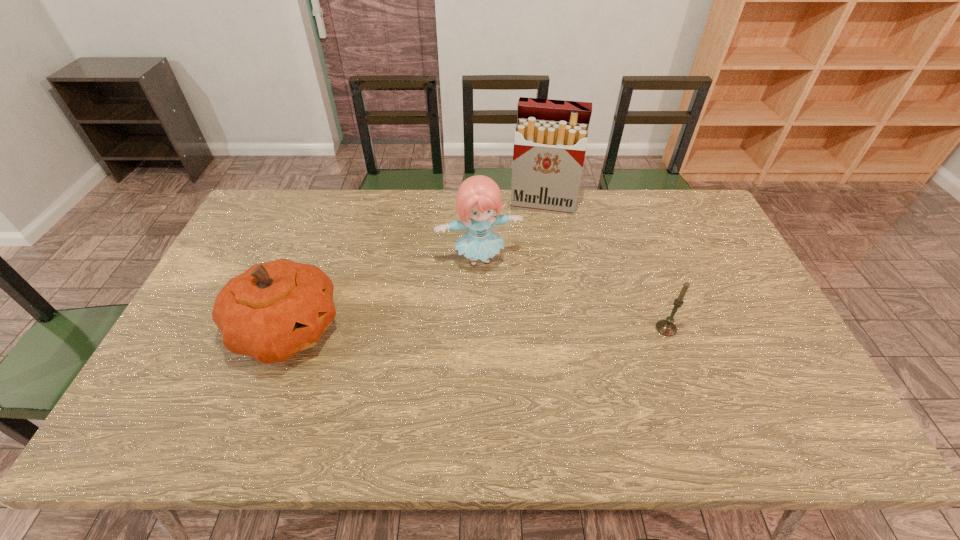
Identify the location of free space on the desktop that is between the pumpkin and the candle and is positioned with the lid open on the farthest object. (526, 329).

Locate an element on the screen. This screenshot has height=540, width=960. free space on the desktop that is between the pumpkin and the candle and is positioned on the front-facing side of the doll is located at coordinates (500, 329).